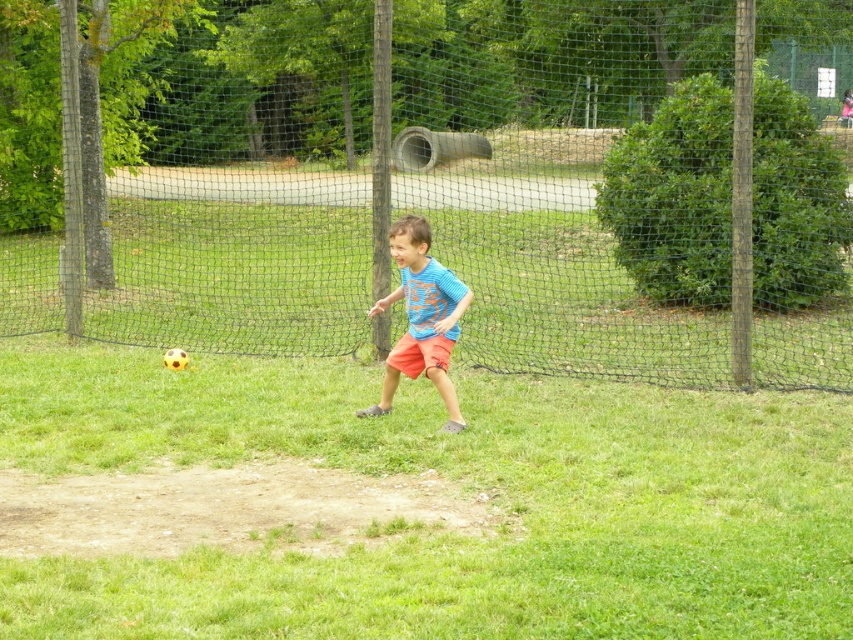
You are a soccer ball that just got kicked by the boy wearing the blue cotton shirt at center. You want to stay within the playing area enclosed by the black mesh fence at center. Considering their widths, is there enough space for you to move freely without hitting the fence?

The black mesh fence at center is wider than the blue cotton shirt at center. Since the fence is wider, there is sufficient space for the soccer ball to move freely within the playing area without hitting the fence.

You are a soccer ball that just got kicked by the boy wearing the blue cotton shirt at center. You want to roll towards the black mesh fence at center. Considering their positions, will you reach the fence before reaching the shirt?

The black mesh fence at center is further to the viewer than the blue cotton shirt at center, so the ball will reach the shirt before the fence.